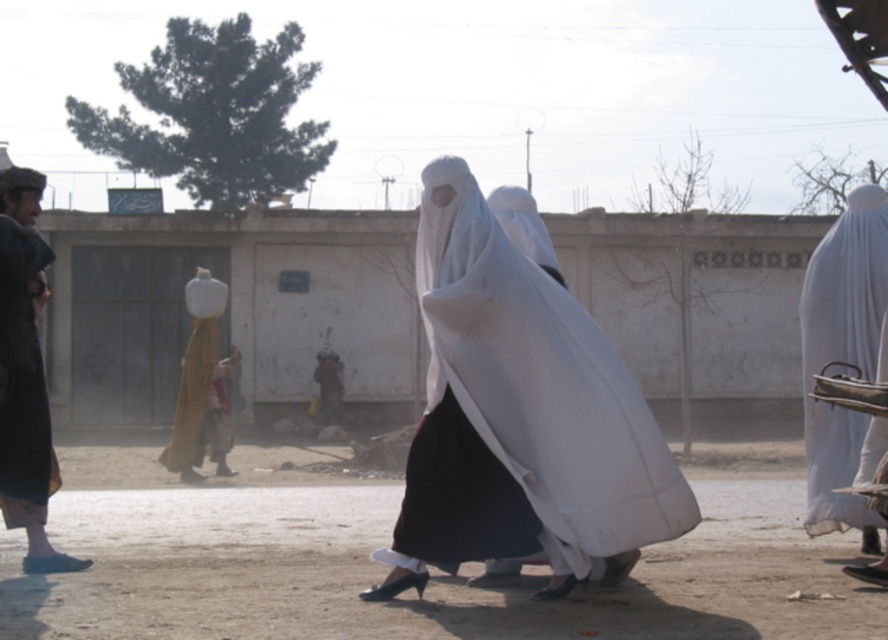
Question: Is white sheer veil at center further to camera compared to white matte burqa at right?

Choices:
 (A) no
 (B) yes

Answer: (A)

Question: Which of the following is the farthest from the observer?

Choices:
 (A) (648, 440)
 (B) (849, 285)
 (C) (91, 618)
 (D) (16, 435)

Answer: (B)

Question: Can you confirm if white sheer veil at center is thinner than dark brown leather jacket at left?

Choices:
 (A) no
 (B) yes

Answer: (A)

Question: Observing the image, what is the correct spatial positioning of white matte burqa at right in reference to dark brown leather jacket at left?

Choices:
 (A) below
 (B) above

Answer: (B)

Question: Estimate the real-world distances between objects in this image. Which object is closer to the white matte burqa at right?

Choices:
 (A) dark brown leather jacket at left
 (B) dirt field at lower center
 (C) white sheer veil at center

Answer: (C)

Question: Which object is closer to the camera taking this photo?

Choices:
 (A) dark brown leather jacket at left
 (B) dirt field at lower center

Answer: (B)